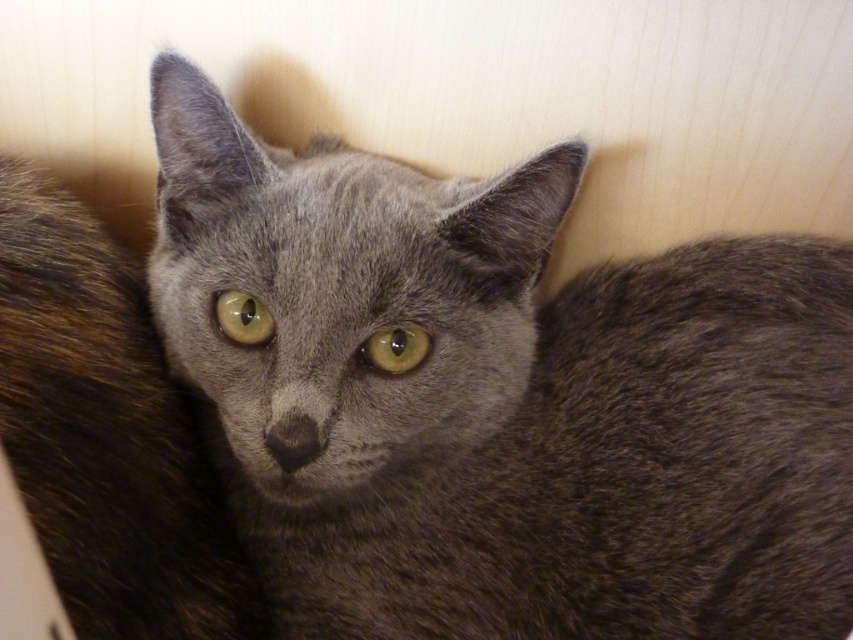
Question: Is yellow-green eye at center above green glossy eye at center?

Choices:
 (A) no
 (B) yes

Answer: (A)

Question: Is yellow-green eye at center positioned in front of green glossy eye at center?

Choices:
 (A) no
 (B) yes

Answer: (B)

Question: Which point is closer to the camera?

Choices:
 (A) yellow-green eye at center
 (B) green glossy eye at center

Answer: (A)

Question: Does yellow-green eye at center appear on the right side of green glossy eye at center?

Choices:
 (A) yes
 (B) no

Answer: (A)

Question: Which of the following is the closest to the observer?

Choices:
 (A) (254, 326)
 (B) (358, 352)

Answer: (B)